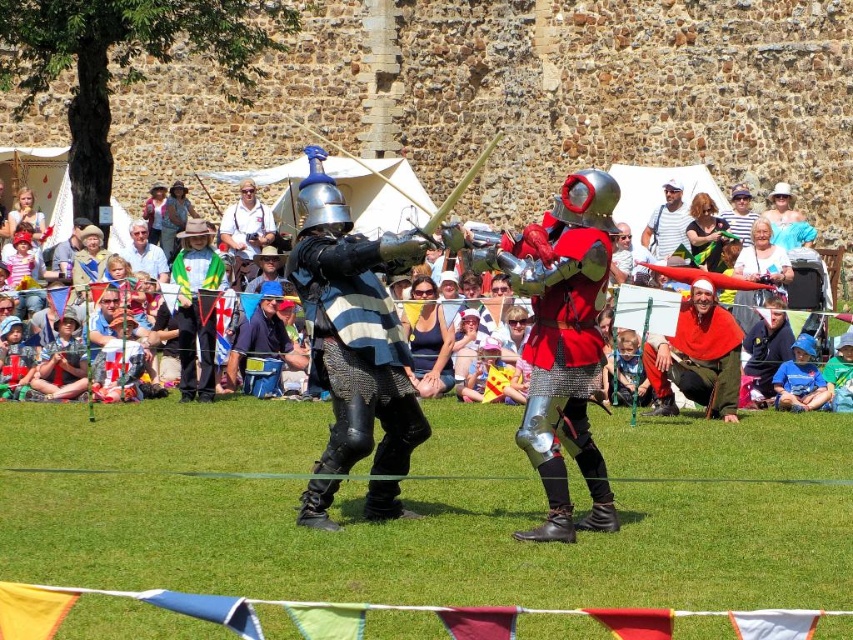
Who is positioned more to the right, red fabric cape at center or matte black helmet at upper center?

Positioned to the right is red fabric cape at center.

The height and width of the screenshot is (640, 853). In order to click on red fabric cape at center in this screenshot , I will do `click(697, 356)`.

Can you confirm if matte black helmet at upper center is positioned to the left of light brown leather jacket at center?

Incorrect, matte black helmet at upper center is not on the left side of light brown leather jacket at center.

Does matte black helmet at upper center have a smaller size compared to light brown leather jacket at center?

No.

Measure the distance between matte black helmet at upper center and camera.

The distance of matte black helmet at upper center from camera is 231.45 feet.

Locate an element on the screen. The image size is (853, 640). matte black helmet at upper center is located at coordinates (631, 192).

Does red fabric cape at center have a smaller size compared to matte white shirt at upper center?

Actually, red fabric cape at center might be larger than matte white shirt at upper center.

From the picture: Is the position of red fabric cape at center less distant than that of matte white shirt at upper center?

That is True.

Which is behind, point (709, 356) or point (686, 250)?

Positioned behind is point (686, 250).

The image size is (853, 640). Find the location of `red fabric cape at center`. red fabric cape at center is located at coordinates (697, 356).